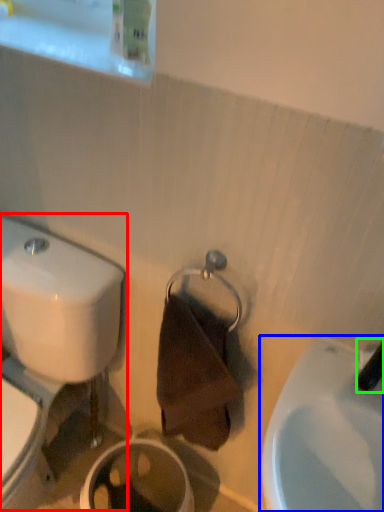
Question: Considering the real-world distances, which object is farthest from toilet (highlighted by a red box)? sink (highlighted by a blue box) or plumbing fixture (highlighted by a green box)?

Choices:
 (A) sink
 (B) plumbing fixture

Answer: (B)